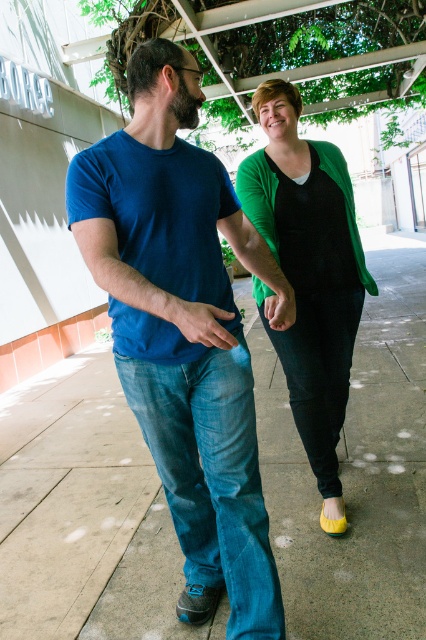
Question: Considering the relative positions of smooth concrete pavement at center and matte blue jeans at center in the image provided, where is smooth concrete pavement at center located with respect to matte blue jeans at center?

Choices:
 (A) below
 (B) above

Answer: (A)

Question: Does blue denim jeans at left appear on the left side of green matte cardigan at center?

Choices:
 (A) no
 (B) yes

Answer: (B)

Question: Among these objects, which one is farthest from the camera?

Choices:
 (A) blue denim jeans at left
 (B) denim jeans at center
 (C) smooth concrete pavement at center

Answer: (C)

Question: Which point is farther to the camera?

Choices:
 (A) blue denim jeans at left
 (B) matte blue jeans at center

Answer: (A)

Question: Which point is closer to the camera?

Choices:
 (A) green matte cardigan at center
 (B) denim jeans at center

Answer: (B)

Question: Does smooth concrete pavement at center come in front of blue denim jeans at left?

Choices:
 (A) no
 (B) yes

Answer: (A)